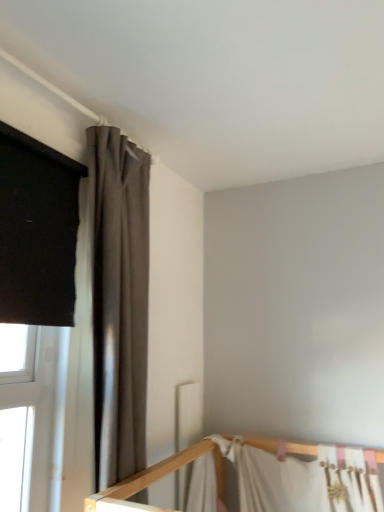
Question: From a real-world perspective, is dark gray matte curtain at upper left beneath white fabric bed at lower right?

Choices:
 (A) yes
 (B) no

Answer: (B)

Question: Is white fabric bed at lower right inside dark gray matte curtain at upper left?

Choices:
 (A) no
 (B) yes

Answer: (A)

Question: From the image's perspective, would you say dark gray matte curtain at upper left is positioned over white fabric bed at lower right?

Choices:
 (A) yes
 (B) no

Answer: (A)

Question: Would you consider dark gray matte curtain at upper left to be distant from white fabric bed at lower right?

Choices:
 (A) yes
 (B) no

Answer: (B)

Question: Does dark gray matte curtain at upper left have a greater height compared to white fabric bed at lower right?

Choices:
 (A) yes
 (B) no

Answer: (A)

Question: Is the position of dark gray matte curtain at upper left more distant than that of white fabric bed at lower right?

Choices:
 (A) yes
 (B) no

Answer: (B)

Question: From the image's perspective, does white fabric bed at lower right appear higher than dark gray matte curtain at upper left?

Choices:
 (A) yes
 (B) no

Answer: (B)

Question: Is white fabric bed at lower right next to dark gray matte curtain at upper left?

Choices:
 (A) yes
 (B) no

Answer: (B)

Question: Is the position of white fabric bed at lower right more distant than that of dark gray matte curtain at upper left?

Choices:
 (A) no
 (B) yes

Answer: (B)

Question: Does white fabric bed at lower right have a lesser width compared to dark gray matte curtain at upper left?

Choices:
 (A) no
 (B) yes

Answer: (B)

Question: Is white fabric bed at lower right shorter than dark gray matte curtain at upper left?

Choices:
 (A) yes
 (B) no

Answer: (A)

Question: Is white fabric bed at lower right positioned before dark gray matte curtain at upper left?

Choices:
 (A) yes
 (B) no

Answer: (B)

Question: Is white fabric bed at lower right in front of or behind dark gray matte curtain at upper left in the image?

Choices:
 (A) behind
 (B) front

Answer: (A)